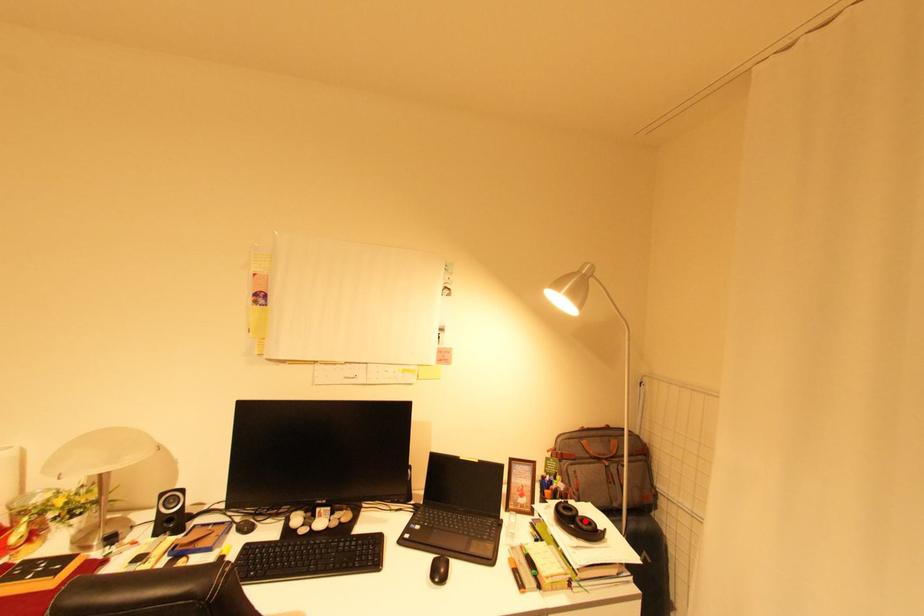
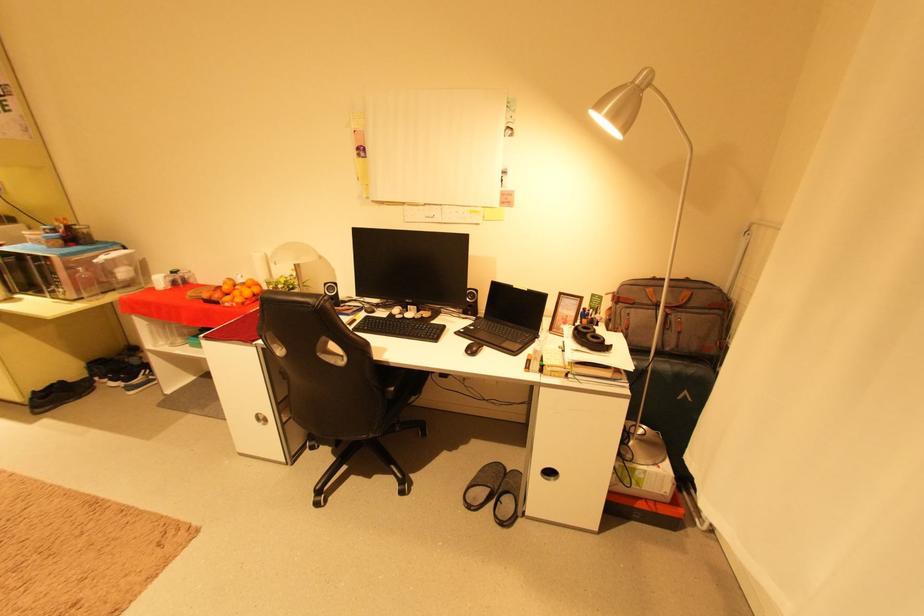
Find the pixel in the second image that matches the highlighted location in the first image.

(596, 336)